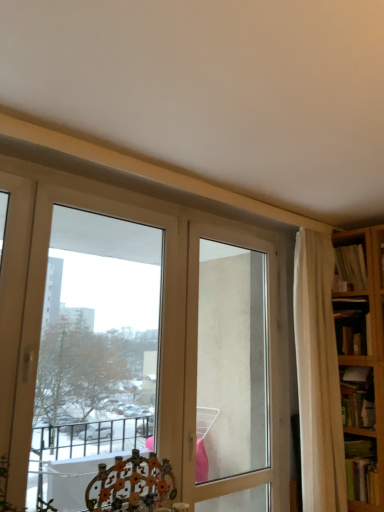
Question: Is hardcover book at lower right, which is the fourth book in top-to-bottom order, turned away from wooden bookshelf at right, which appears as the 3th book when ordered from the bottom?

Choices:
 (A) no
 (B) yes

Answer: (A)

Question: Is hardcover book at lower right, which is the fourth book in top-to-bottom order, at the right side of wooden bookshelf at right, which appears as the 3th book when ordered from the bottom?

Choices:
 (A) yes
 (B) no

Answer: (B)

Question: Is hardcover book at lower right, the first book when ordered from bottom to top, wider than wooden bookshelf at right, which appears as the second book when viewed from the top?

Choices:
 (A) no
 (B) yes

Answer: (A)

Question: Could wooden bookshelf at right, which appears as the 3th book when ordered from the bottom, be considered to be inside hardcover book at lower right, the first book when ordered from bottom to top?

Choices:
 (A) no
 (B) yes

Answer: (A)

Question: Considering the relative positions of hardcover book at lower right, the first book when ordered from bottom to top, and wooden bookshelf at right, which appears as the second book when viewed from the top, in the image provided, is hardcover book at lower right, the first book when ordered from bottom to top, behind wooden bookshelf at right, which appears as the second book when viewed from the top,?

Choices:
 (A) no
 (B) yes

Answer: (A)

Question: From the image's perspective, is wooden bookshelf at right, which appears as the 3th book when ordered from the bottom, positioned above or below white fabric curtain at right?

Choices:
 (A) below
 (B) above

Answer: (B)

Question: In terms of size, does wooden bookshelf at right, which appears as the 3th book when ordered from the bottom, appear bigger or smaller than white fabric curtain at right?

Choices:
 (A) big
 (B) small

Answer: (B)

Question: Considering the positions of point (354, 326) and point (334, 337), is point (354, 326) closer or farther from the camera than point (334, 337)?

Choices:
 (A) farther
 (B) closer

Answer: (A)

Question: Is wooden bookshelf at right, which appears as the 3th book when ordered from the bottom, to the left or to the right of white fabric curtain at right in the image?

Choices:
 (A) right
 (B) left

Answer: (A)

Question: Is hardcover book at right, the 3th book when ordered from top to bottom, in front of or behind metallic floral chair at lower center in the image?

Choices:
 (A) front
 (B) behind

Answer: (B)

Question: Is point (357, 396) positioned closer to the camera than point (107, 487)?

Choices:
 (A) farther
 (B) closer

Answer: (A)

Question: From a real-world perspective, is hardcover book at right, the 2th book from the bottom, physically located above or below metallic floral chair at lower center?

Choices:
 (A) above
 (B) below

Answer: (A)

Question: From the image's perspective, is hardcover book at right, the 3th book when ordered from top to bottom, positioned above or below metallic floral chair at lower center?

Choices:
 (A) below
 (B) above

Answer: (B)

Question: Is hardcover book at right, the 3th book when ordered from top to bottom, situated inside transparent glass screen door at center or outside?

Choices:
 (A) outside
 (B) inside

Answer: (A)

Question: From a real-world perspective, is hardcover book at right, the 2th book from the bottom, positioned above or below transparent glass screen door at center?

Choices:
 (A) above
 (B) below

Answer: (B)